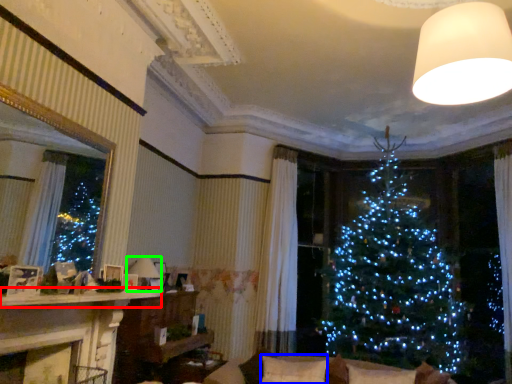
Question: Considering the real-world distances, which object is closest to mantle (highlighted by a red box)? pillow (highlighted by a blue box) or lamp (highlighted by a green box).

Choices:
 (A) pillow
 (B) lamp

Answer: (B)